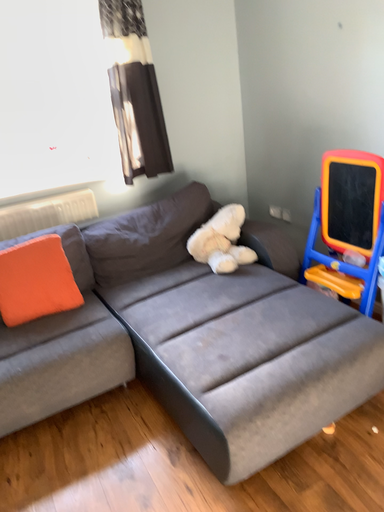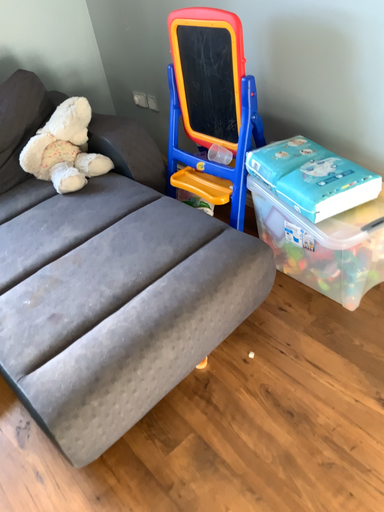
Question: Which way did the camera rotate in the video?

Choices:
 (A) rotated left
 (B) rotated right

Answer: (B)